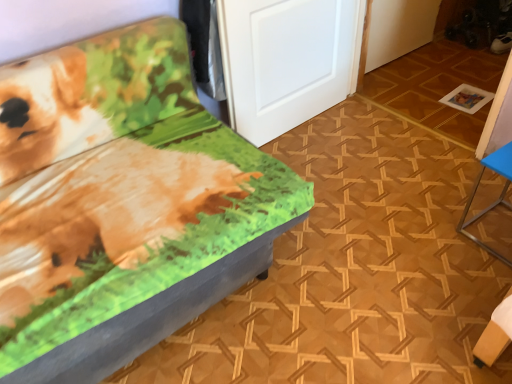
This screenshot has height=384, width=512. I want to click on free region on the left part of blue metallic table at right, which is the first furniture in right-to-left order, so click(x=445, y=238).